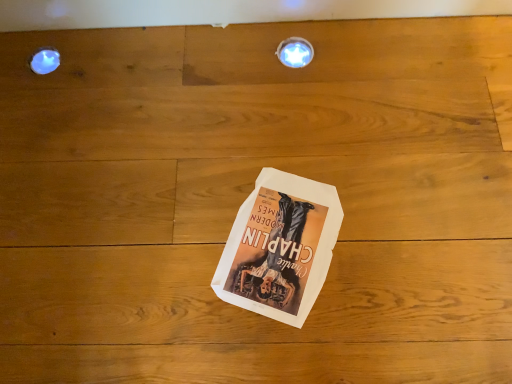
Question: Is metallic circular light fixture at upper center taller or shorter than matte white droplight at upper left?

Choices:
 (A) tall
 (B) short

Answer: (A)

Question: Based on their sizes in the image, would you say metallic circular light fixture at upper center is bigger or smaller than matte white droplight at upper left?

Choices:
 (A) big
 (B) small

Answer: (A)

Question: Based on their relative distances, which object is nearer to the white paper at center?

Choices:
 (A) metallic circular light fixture at upper center
 (B) matte white droplight at upper left

Answer: (A)

Question: Which object is positioned farthest from the matte white droplight at upper left?

Choices:
 (A) white paper at center
 (B) metallic circular light fixture at upper center

Answer: (A)